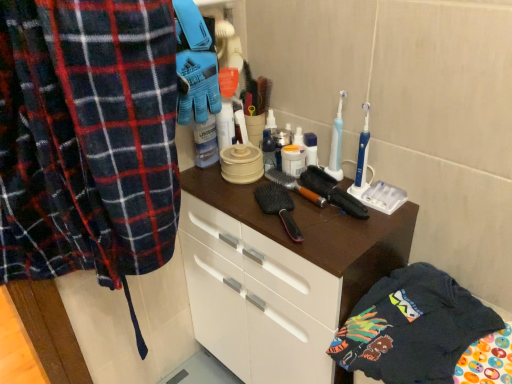
Where is `vacant space in front of black rubber brush at center, the 1th brush when ordered from right to left`? The width and height of the screenshot is (512, 384). vacant space in front of black rubber brush at center, the 1th brush when ordered from right to left is located at coordinates (346, 236).